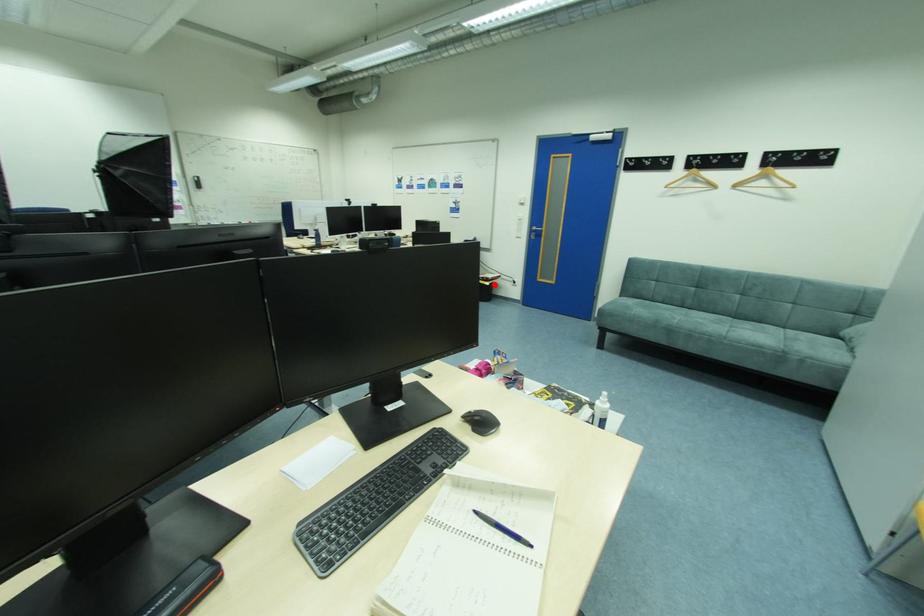
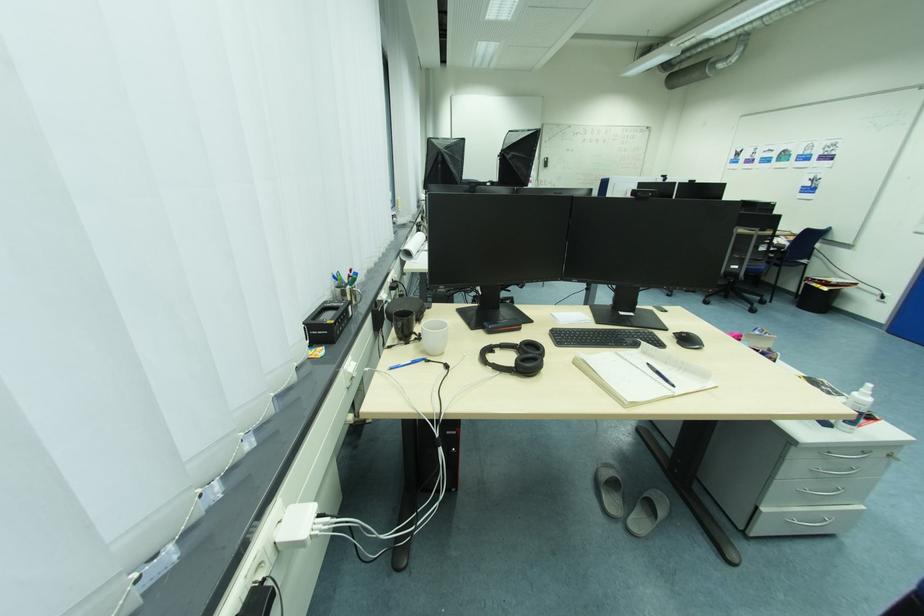
Question: I am providing you with two images of the same scene from different viewpoints. Image1 has a red point marked. In image2, the corresponding 3D location appears at what relative position? Reply with the corresponding letter.

Choices:
 (A) Closer
 (B) Farther

Answer: (B)